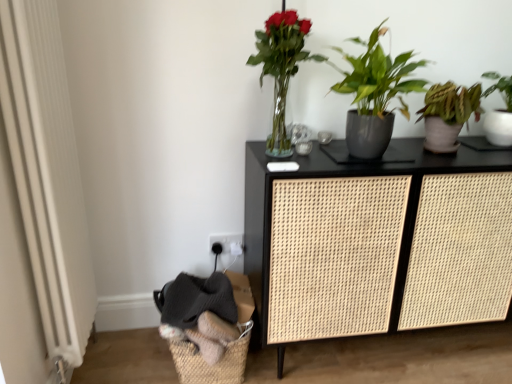
You are a GUI agent. You are given a task and a screenshot of the screen. Output one action in this format:
    pyautogui.click(x=<x>, y=<y>)
    Task: Click on the vacant space underneath black rattan cabinet at center (from a real-world perspective)
    This screenshot has width=512, height=384.
    Given the screenshot: What is the action you would take?
    pyautogui.click(x=422, y=341)